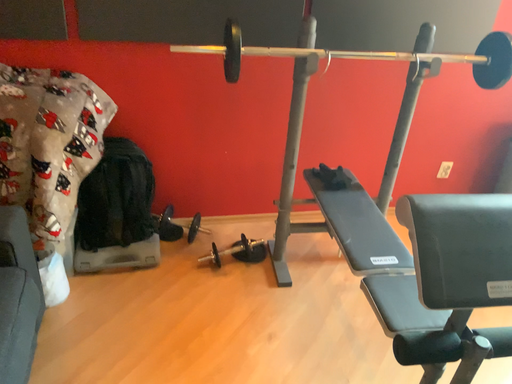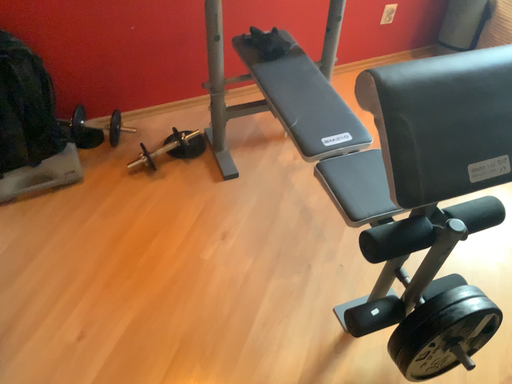
Question: How did the camera likely rotate when shooting the video?

Choices:
 (A) rotated upward
 (B) rotated downward

Answer: (B)